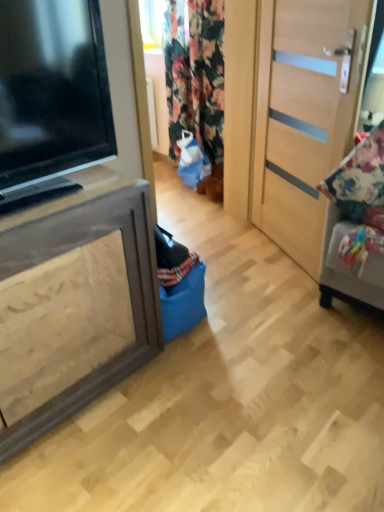
This screenshot has height=512, width=384. What are the coordinates of `floral fabric cushion at right` in the screenshot? It's located at (356, 225).

What is the approximate width of floral fabric cushion at right?

The width of floral fabric cushion at right is 10.69 inches.

In order to face light wood door at right, should I rotate leftwards or rightwards?

You should rotate right by 13.128 degrees.

Describe the element at coordinates (305, 114) in the screenshot. I see `light wood door at right` at that location.

Where is `brown wood cabinet at left`? brown wood cabinet at left is located at coordinates (74, 302).

This screenshot has width=384, height=512. In order to click on floral fabric cushion at right in this screenshot , I will do `click(356, 225)`.

Is point (125, 285) closer or farther from the camera than point (309, 22)?

Point (125, 285) is closer to the camera than point (309, 22).

Is brown wood cabinet at left beside light wood door at right?

No, brown wood cabinet at left is not with light wood door at right.

From the image's perspective, which is above, brown wood cabinet at left or light wood door at right?

light wood door at right is shown above in the image.

How far apart are brown wood cabinet at left and light wood door at right?

brown wood cabinet at left is 1.22 meters from light wood door at right.

Find the location of a particular element. cabinetry located on the left of floral fabric cushion at right is located at coordinates (74, 302).

From the image's perspective, is floral fabric cushion at right positioned above or below brown wood cabinet at left?

Clearly, from the image's perspective, floral fabric cushion at right is above brown wood cabinet at left.

Is floral fabric cushion at right located outside brown wood cabinet at left?

floral fabric cushion at right lies outside brown wood cabinet at left's area.

Based on the photo, is floral fabric cushion at right looking in the opposite direction of brown wood cabinet at left?

No, floral fabric cushion at right is not facing the opposite direction of brown wood cabinet at left.

From the image's perspective, does floral fabric curtain at center appear lower than floral fabric cushion at right?

No.

From a real-world perspective, who is located lower, floral fabric curtain at center or floral fabric cushion at right?

In real-world perspective, floral fabric cushion at right is lower.

Which is more distant, (182, 2) or (374, 198)?

Point (182, 2)

Where is `curtain that appears behind the floral fabric cushion at right`? The height and width of the screenshot is (512, 384). curtain that appears behind the floral fabric cushion at right is located at coordinates 195,73.

Can you confirm if light wood door at right is shorter than floral fabric curtain at center?

In fact, light wood door at right may be taller than floral fabric curtain at center.

Based on the photo, from the image's perspective, which object appears higher, light wood door at right or floral fabric curtain at center?

floral fabric curtain at center appears higher in the image.

Considering the positions of objects light wood door at right and floral fabric curtain at center in the image provided, who is more to the left, light wood door at right or floral fabric curtain at center?

Positioned to the left is floral fabric curtain at center.

Which is farther from the camera, (346, 98) or (190, 87)?

The point (190, 87) is behind.

From the picture: Is brown wood cabinet at left bigger than black glossy television at left?

Indeed, brown wood cabinet at left has a larger size compared to black glossy television at left.

How far apart are brown wood cabinet at left and black glossy television at left?

14.06 inches.

How different are the orientations of brown wood cabinet at left and black glossy television at left in degrees?

The facing directions of brown wood cabinet at left and black glossy television at left are 0.62 degrees apart.

Would you say brown wood cabinet at left is outside black glossy television at left?

Yes, brown wood cabinet at left is outside of black glossy television at left.

Does black glossy television at left turn towards floral fabric curtain at center?

No, black glossy television at left is not aimed at floral fabric curtain at center.

Which of these two, black glossy television at left or floral fabric curtain at center, is smaller?

black glossy television at left.

Where is `curtain that is on the right side of black glossy television at left`? curtain that is on the right side of black glossy television at left is located at coordinates (195, 73).

From a real-world perspective, is floral fabric cushion at right on black glossy television at left?

Incorrect, from a real-world perspective, floral fabric cushion at right is lower than black glossy television at left.

Between floral fabric cushion at right and black glossy television at left, which one has more height?

Standing taller between the two is floral fabric cushion at right.

Can you confirm if floral fabric cushion at right is positioned to the left of black glossy television at left?

No.

Considering the positions of objects floral fabric cushion at right and black glossy television at left in the image provided, who is behind, floral fabric cushion at right or black glossy television at left?

floral fabric cushion at right is behind.

The image size is (384, 512). Identify the location of cabinetry that is below the light wood door at right (from the image's perspective). (74, 302).

You are a GUI agent. You are given a task and a screenshot of the screen. Output one action in this format:
    pyautogui.click(x=<x>, y=<y>)
    Task: Click on the furniture on the right of the brown wood cabinet at left
    This screenshot has height=512, width=384.
    Given the screenshot: What is the action you would take?
    pyautogui.click(x=356, y=225)

Based on the photo, looking at the image, which one is located further to black glossy television at left, floral fabric curtain at center or floral fabric cushion at right?

The object further to black glossy television at left is floral fabric curtain at center.

Which object lies further to the anchor point brown wood cabinet at left, black glossy television at left or floral fabric curtain at center?

The object further to brown wood cabinet at left is floral fabric curtain at center.

Based on their spatial positions, is black glossy television at left or brown wood cabinet at left closer to floral fabric curtain at center?

black glossy television at left is positioned closer to the anchor floral fabric curtain at center.

Based on their spatial positions, is floral fabric curtain at center or brown wood cabinet at left further from black glossy television at left?

floral fabric curtain at center is positioned further to the anchor black glossy television at left.

From the image, which object appears to be nearer to brown wood cabinet at left, floral fabric cushion at right or floral fabric curtain at center?

floral fabric cushion at right lies closer to brown wood cabinet at left than the other object.

In the scene shown: Based on their spatial positions, is light wood door at right or floral fabric cushion at right closer to brown wood cabinet at left?

floral fabric cushion at right is positioned closer to the anchor brown wood cabinet at left.

When comparing their distances from light wood door at right, does brown wood cabinet at left or floral fabric cushion at right seem further?

brown wood cabinet at left.

When comparing their distances from black glossy television at left, does brown wood cabinet at left or floral fabric curtain at center seem further?

Among the two, floral fabric curtain at center is located further to black glossy television at left.

Locate an element on the screen. The width and height of the screenshot is (384, 512). cabinetry between black glossy television at left and floral fabric curtain at center along the z-axis is located at coordinates (74, 302).

The width and height of the screenshot is (384, 512). Identify the location of door between brown wood cabinet at left and floral fabric curtain at center from front to back. (305, 114).

The image size is (384, 512). In order to click on furniture positioned between black glossy television at left and floral fabric curtain at center from near to far in this screenshot , I will do `click(356, 225)`.

You are a GUI agent. You are given a task and a screenshot of the screen. Output one action in this format:
    pyautogui.click(x=<x>, y=<y>)
    Task: Click on the door between black glossy television at left and floral fabric cushion at right from left to right
    The image size is (384, 512).
    Given the screenshot: What is the action you would take?
    pyautogui.click(x=305, y=114)